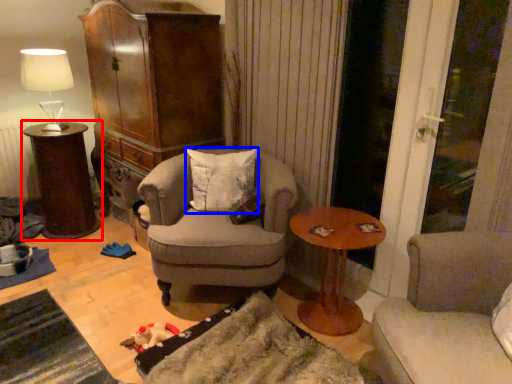
Question: Which object appears closest to the camera in this image, table (highlighted by a red box) or pillow (highlighted by a blue box)?

Choices:
 (A) table
 (B) pillow

Answer: (B)